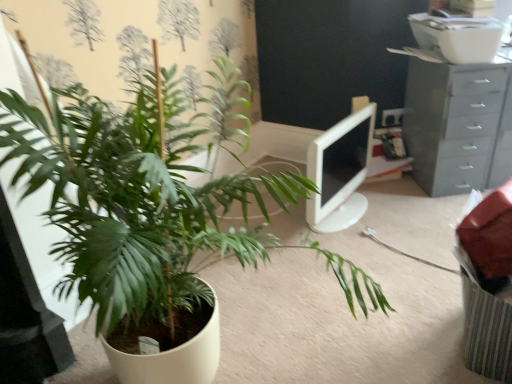
This screenshot has height=384, width=512. I want to click on green matte plant at center-left, so click(127, 202).

Describe the element at coordinates (458, 125) in the screenshot. I see `gray plastic chest of drawers at upper right` at that location.

Where is `white glossy monitor at center`? Image resolution: width=512 pixels, height=384 pixels. white glossy monitor at center is located at coordinates (340, 172).

This screenshot has height=384, width=512. What are the coordinates of `green matte plant at center-left` in the screenshot? It's located at (127, 202).

From the image's perspective, is white glossy monitor at center located beneath green matte plant at center-left?

Incorrect, from the image's perspective, white glossy monitor at center is higher than green matte plant at center-left.

Is point (331, 179) positioned in front of point (67, 133)?

No, (331, 179) is further to viewer.

From the picture: Is white glossy monitor at center far from green matte plant at center-left?

Actually, white glossy monitor at center and green matte plant at center-left are a little close together.

In the scene shown: From a real-world perspective, is green matte plant at center-left beneath gray plastic chest of drawers at upper right?

No, from a real-world perspective, green matte plant at center-left is not below gray plastic chest of drawers at upper right.

Between point (82, 293) and point (502, 179), which one is positioned in front?

The point (82, 293) is more forward.

Locate an element on the screen. The image size is (512, 384). the chest of drawers behind the green matte plant at center-left is located at coordinates (458, 125).

Who is smaller, gray plastic chest of drawers at upper right or white glossy monitor at center?

white glossy monitor at center is smaller.

Does point (468, 167) appear closer or farther from the camera than point (308, 206)?

Point (468, 167) appears to be farther away from the viewer than point (308, 206).

Consider the image. Which of these two, gray plastic chest of drawers at upper right or white glossy monitor at center, is wider?

gray plastic chest of drawers at upper right is wider.

Image resolution: width=512 pixels, height=384 pixels. What are the coordinates of `the chest of drawers that is behind the white glossy monitor at center` in the screenshot? It's located at (458, 125).

Is white glossy monitor at center a part of green matte plant at center-left?

Actually, white glossy monitor at center is outside green matte plant at center-left.

How distant is green matte plant at center-left from white glossy monitor at center?

green matte plant at center-left and white glossy monitor at center are 79.58 centimeters apart.

From a real-world perspective, which is physically above, green matte plant at center-left or white glossy monitor at center?

green matte plant at center-left, from a real-world perspective.

In the scene shown: Does green matte plant at center-left touch white glossy monitor at center?

No.

From their relative heights in the image, would you say gray plastic chest of drawers at upper right is taller or shorter than green matte plant at center-left?

Clearly, gray plastic chest of drawers at upper right is shorter compared to green matte plant at center-left.

Does gray plastic chest of drawers at upper right have a lesser width compared to green matte plant at center-left?

Yes, gray plastic chest of drawers at upper right is thinner than green matte plant at center-left.

Can you confirm if gray plastic chest of drawers at upper right is bigger than green matte plant at center-left?

Actually, gray plastic chest of drawers at upper right might be smaller than green matte plant at center-left.

Which is more to the left, gray plastic chest of drawers at upper right or green matte plant at center-left?

From the viewer's perspective, green matte plant at center-left appears more on the left side.

Which object is further away from the camera taking this photo, white glossy monitor at center or gray plastic chest of drawers at upper right?

Positioned behind is gray plastic chest of drawers at upper right.

From a real-world perspective, is white glossy monitor at center over gray plastic chest of drawers at upper right?

No, from a real-world perspective, white glossy monitor at center is not over gray plastic chest of drawers at upper right

This screenshot has width=512, height=384. What are the coordinates of `houseplant that appears above the white glossy monitor at center (from a real-world perspective)` in the screenshot? It's located at (127, 202).

The height and width of the screenshot is (384, 512). What are the coordinates of `the chest of drawers lying above the green matte plant at center-left (from the image's perspective)` in the screenshot? It's located at (458, 125).

Which object lies further to the anchor point gray plastic chest of drawers at upper right, green matte plant at center-left or white glossy monitor at center?

Based on the image, green matte plant at center-left appears to be further to gray plastic chest of drawers at upper right.

From the image, which object appears to be farther from white glossy monitor at center, green matte plant at center-left or gray plastic chest of drawers at upper right?

Among the two, green matte plant at center-left is located further to white glossy monitor at center.

Which object lies further to the anchor point green matte plant at center-left, white glossy monitor at center or gray plastic chest of drawers at upper right?

The object further to green matte plant at center-left is gray plastic chest of drawers at upper right.

From the image, which object appears to be nearer to white glossy monitor at center, gray plastic chest of drawers at upper right or green matte plant at center-left?

gray plastic chest of drawers at upper right.

Which object lies nearer to the anchor point green matte plant at center-left, gray plastic chest of drawers at upper right or white glossy monitor at center?

Based on the image, white glossy monitor at center appears to be nearer to green matte plant at center-left.

Which object lies further to the anchor point gray plastic chest of drawers at upper right, white glossy monitor at center or green matte plant at center-left?

green matte plant at center-left lies further to gray plastic chest of drawers at upper right than the other object.

You are a GUI agent. You are given a task and a screenshot of the screen. Output one action in this format:
    pyautogui.click(x=<x>, y=<y>)
    Task: Click on the computer monitor located between green matte plant at center-left and gray plastic chest of drawers at upper right in the depth direction
    
    Given the screenshot: What is the action you would take?
    pyautogui.click(x=340, y=172)